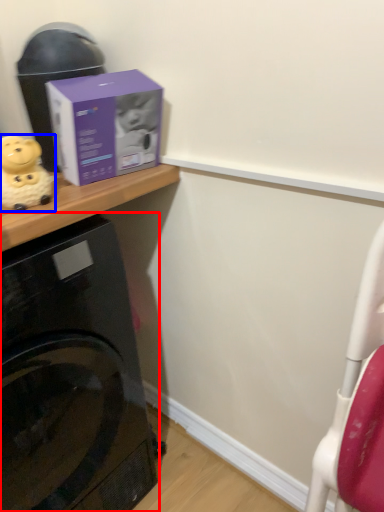
Question: Which object is closer to the camera taking this photo, home appliance (highlighted by a red box) or toy (highlighted by a blue box)?

Choices:
 (A) home appliance
 (B) toy

Answer: (A)